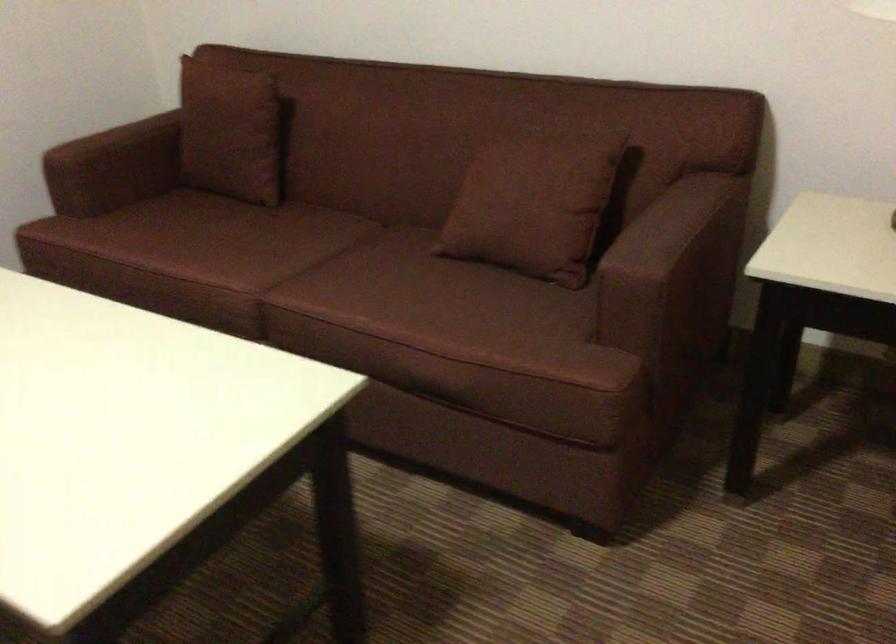
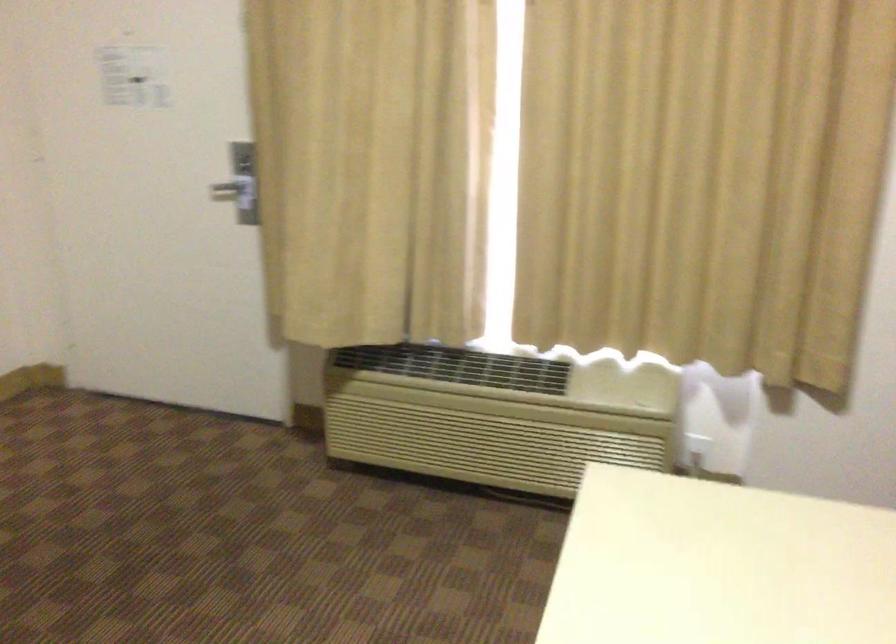
Question: The images are taken continuously from a first-person perspective. In which direction is your viewpoint rotating?

Choices:
 (A) Left
 (B) Right
 (C) Up
 (D) Down

Answer: (A)